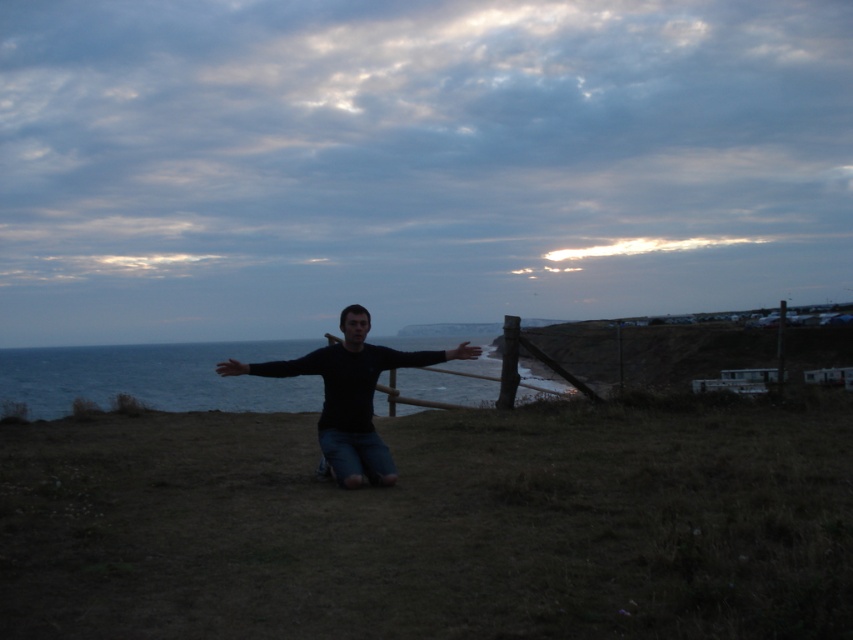
Question: Does black matte shirt at center have a lesser width compared to black matte arm at center?

Choices:
 (A) no
 (B) yes

Answer: (A)

Question: Can you confirm if black matte shirt at center is thinner than black matte arm at center?

Choices:
 (A) yes
 (B) no

Answer: (B)

Question: Estimate the real-world distances between objects in this image. Which object is farther from the brown grassy at center?

Choices:
 (A) black matte arm at center
 (B) black matte shirt at center
 (C) blue water at center

Answer: (C)

Question: Is brown grassy at center wider than black matte shirt at center?

Choices:
 (A) yes
 (B) no

Answer: (B)

Question: Which of the following is the farthest from the observer?

Choices:
 (A) (457, 356)
 (B) (172, 410)
 (C) (113, 480)
 (D) (354, 320)

Answer: (B)

Question: Which point is farther to the camera?

Choices:
 (A) brown grassy at center
 (B) black matte arm at center
 (C) black matte shirt at center

Answer: (B)